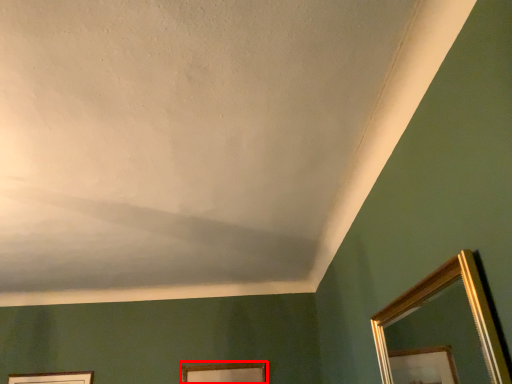
Question: From the image's perspective, considering the relative positions of picture frame (annotated by the red box) and mirror in the image provided, where is picture frame (annotated by the red box) located with respect to the staircase?

Choices:
 (A) above
 (B) below

Answer: (B)